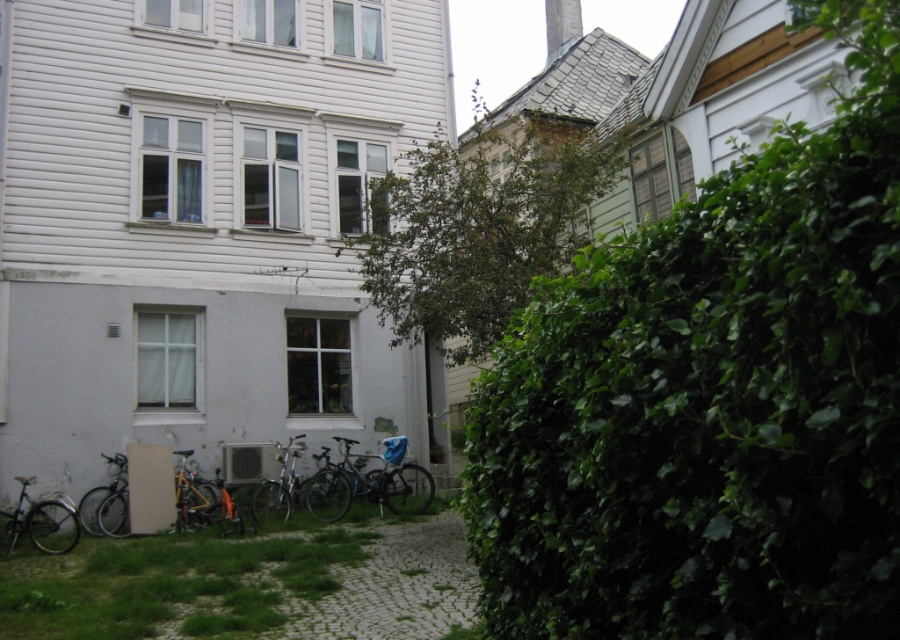
You are standing in the residential area and want to reach a point that is exactly 46.66 feet away from you. Can you determine if the point at coordinates point (123, 490) is the correct location?

The point at coordinates point (123, 490) is exactly 46.66 feet away from the viewer, so yes, it is the correct location.

You are standing in front of the house and want to move the shiny silver bicycle at lower left to the position of the silver metallic bicycle at center. Which direction should you move it?

The shiny silver bicycle at lower left is closer to the viewer than the silver metallic bicycle at center. To move it to the position of the silver metallic bicycle at center, you should move it backward away from you.